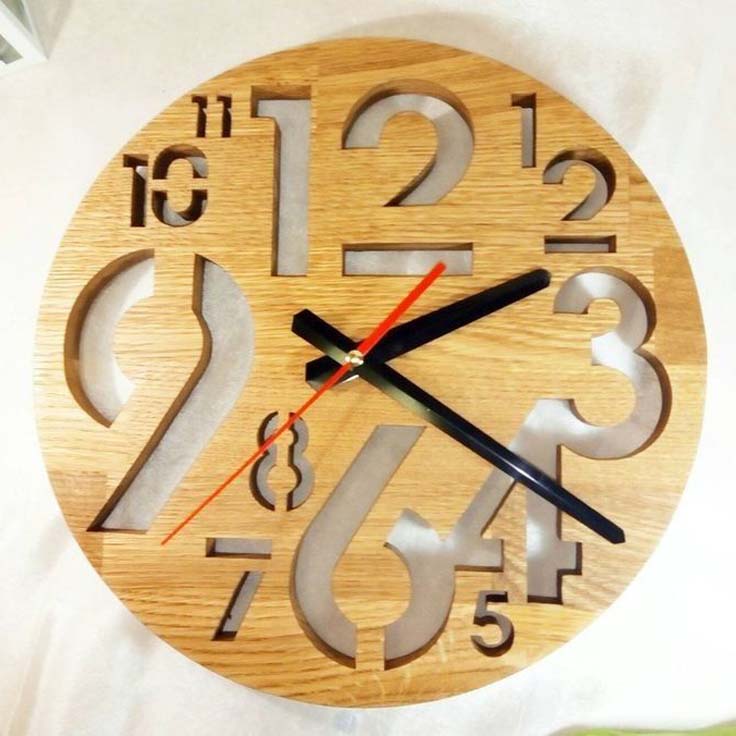
The width and height of the screenshot is (736, 736). What are the coordinates of `picture of wooden clock` in the screenshot? It's located at 411,372.